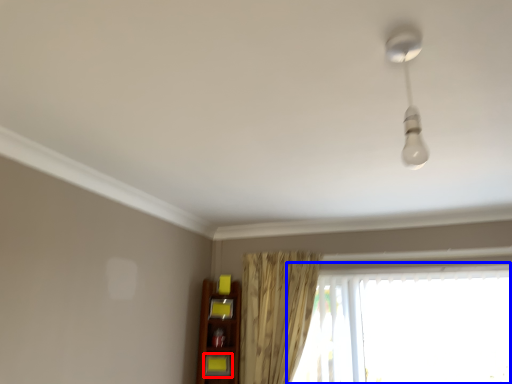
Question: Which point is further to the camera, shelf (highlighted by a red box) or window (highlighted by a blue box)?

Choices:
 (A) shelf
 (B) window

Answer: (A)